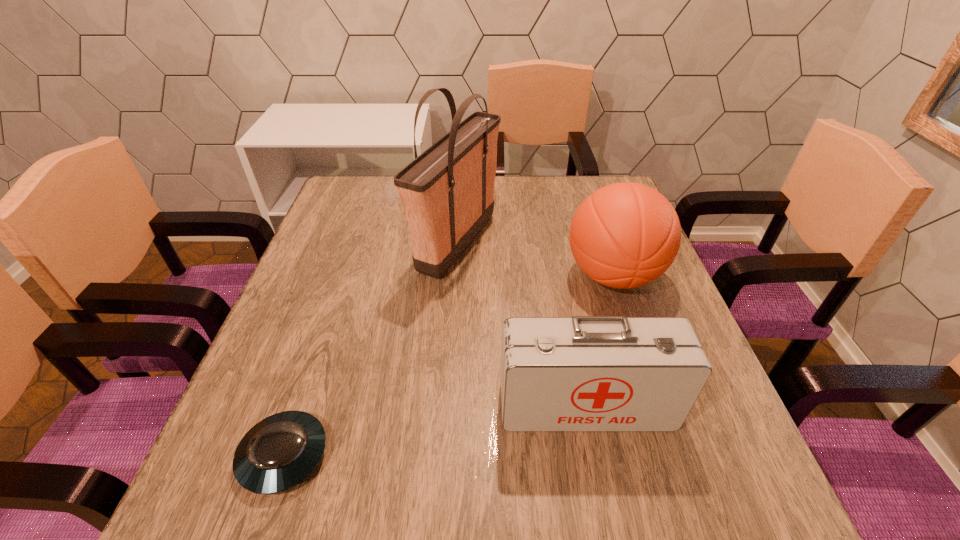
This screenshot has height=540, width=960. In order to click on free space between the shopping bag and the basketball in this screenshot , I will do [535, 259].

The width and height of the screenshot is (960, 540). What are the coordinates of `free spot between the tallest object and the shortest object` in the screenshot? It's located at (371, 349).

At what (x,y) coordinates should I click in order to perform the action: click on empty space between the saucer and the basketball. Please return your answer as a coordinate pair (x, y). Looking at the image, I should click on (448, 366).

Image resolution: width=960 pixels, height=540 pixels. I want to click on empty space that is in between the second shortest object and the saucer, so click(435, 431).

In order to click on empty location between the basketball and the shopping bag in this screenshot , I will do `click(535, 259)`.

The width and height of the screenshot is (960, 540). Find the location of `empty location between the basketball and the shortest object`. empty location between the basketball and the shortest object is located at coordinates (448, 366).

What are the coordinates of `empty space between the saucer and the third tallest object` in the screenshot? It's located at (435, 431).

Where is `vacant space in between the shopping bag and the basketball`? vacant space in between the shopping bag and the basketball is located at coordinates (535, 259).

This screenshot has width=960, height=540. I want to click on free space between the saucer and the first-aid kit, so click(x=435, y=431).

The height and width of the screenshot is (540, 960). I want to click on object that stands as the closest to the second tallest object, so click(447, 192).